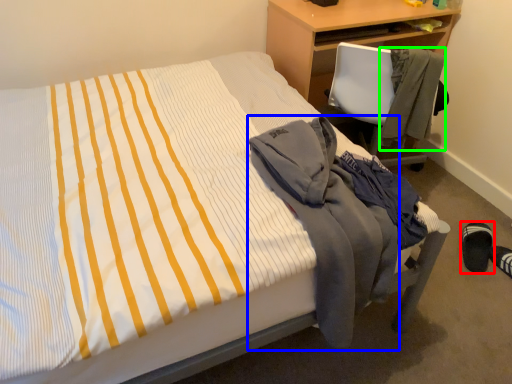
Question: Which object is positioned closest to footwear (highlighted by a red box)? Select from jacket (highlighted by a blue box) and jacket (highlighted by a green box).

Choices:
 (A) jacket
 (B) jacket

Answer: (B)